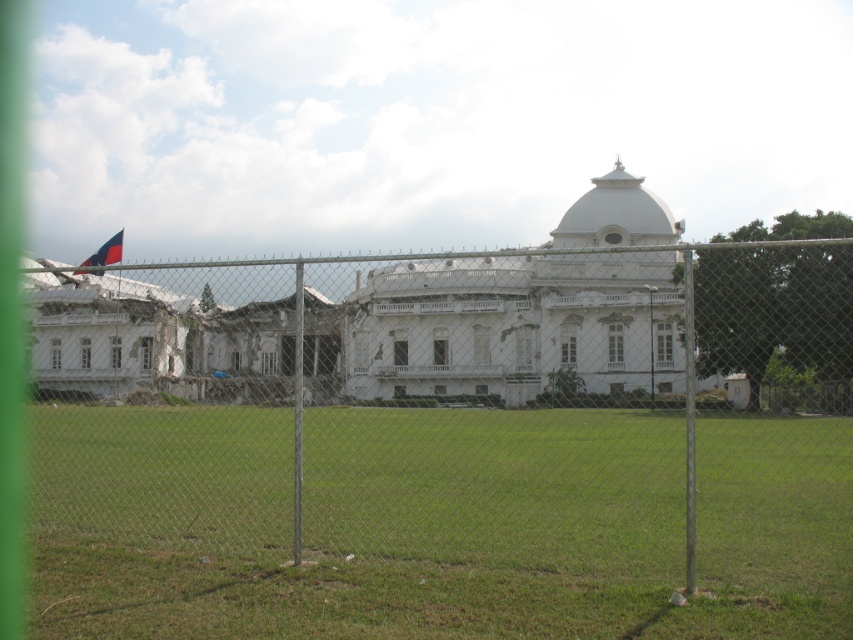
Is point (849, 288) positioned after point (167, 456)?

Yes, it is.

Between point (590, 353) and point (785, 444), which one is positioned in front?

Point (785, 444) is in front.

Locate an element on the screen. metal chain-link fence at center is located at coordinates (456, 410).